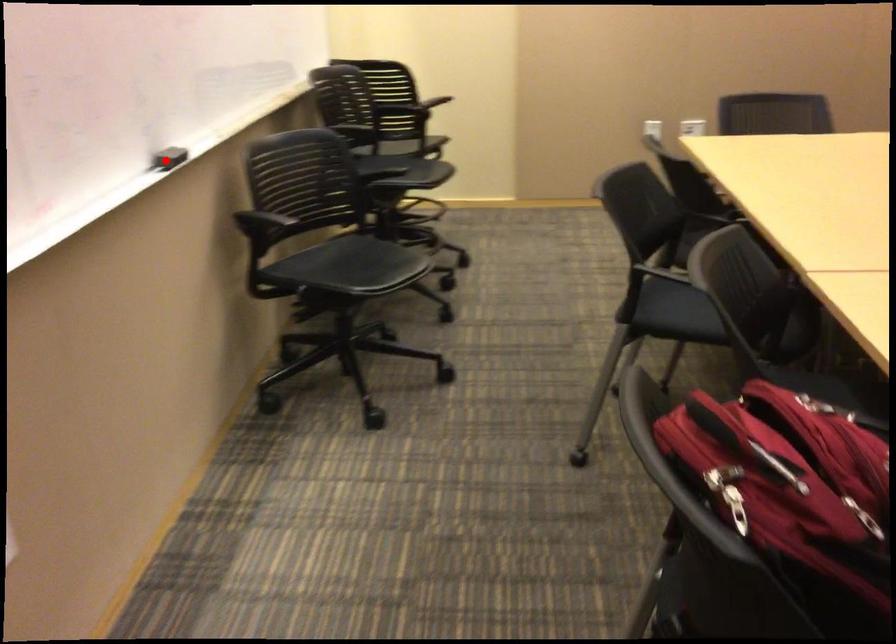
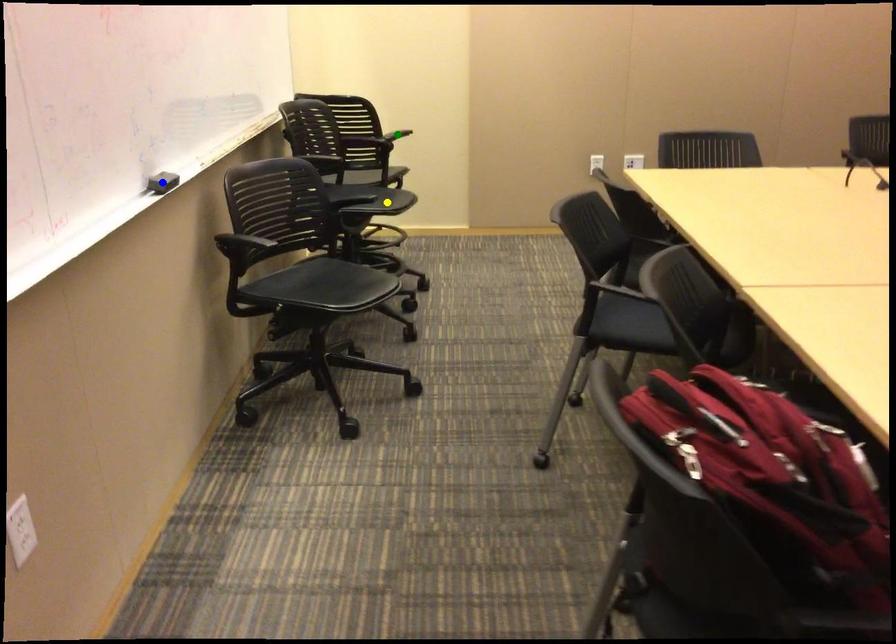
Question: I am providing you with two images of the same scene from different viewpoints. A red point is marked on the first image. You are given multiple points on the second image. Can you choose the point in image 2 that corresponds to the point in image 1?

Choices:
 (A) blue point
 (B) yellow point
 (C) green point

Answer: (A)